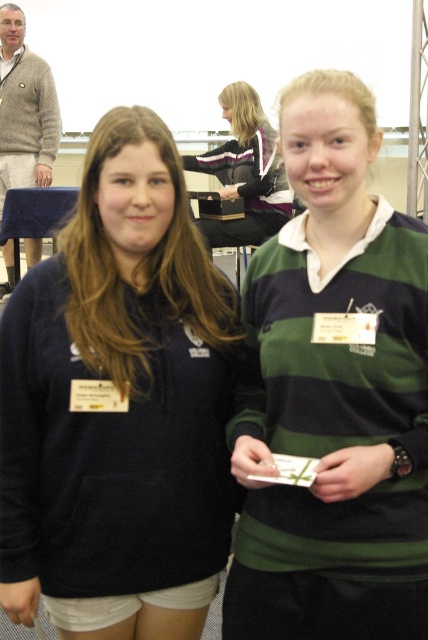
Who is shorter, green striped sweater at center or matte black jacket at center?

green striped sweater at center

Does green striped sweater at center come behind matte black jacket at center?

No, green striped sweater at center is in front of matte black jacket at center.

Where is `green striped sweater at center`? The height and width of the screenshot is (640, 428). green striped sweater at center is located at coordinates (333, 394).

At what (x,y) coordinates should I click in order to perform the action: click on dark blue fleece at center. Please return your answer as a coordinate pair (x, y). Image resolution: width=428 pixels, height=640 pixels. Looking at the image, I should click on (116, 388).

Does dark blue fleece at center have a smaller size compared to knitted gray sweater at upper left?

Yes, dark blue fleece at center is smaller than knitted gray sweater at upper left.

Who is more forward, (112, 576) or (23, 157)?

Point (112, 576) is more forward.

What are the coordinates of `dark blue fleece at center` in the screenshot? It's located at (116, 388).

You are a GUI agent. You are given a task and a screenshot of the screen. Output one action in this format:
    pyautogui.click(x=<x>, y=<y>)
    Task: Click on the matte black jacket at center
    Image resolution: width=428 pixels, height=640 pixels.
    Given the screenshot: What is the action you would take?
    pyautogui.click(x=244, y=172)

Does matte black jacket at center appear on the right side of knitted gray sweater at upper left?

Correct, you'll find matte black jacket at center to the right of knitted gray sweater at upper left.

Does point (243, 109) lie behind point (50, 161)?

No, it is not.

Where is `matte black jacket at center`? The image size is (428, 640). matte black jacket at center is located at coordinates (244, 172).